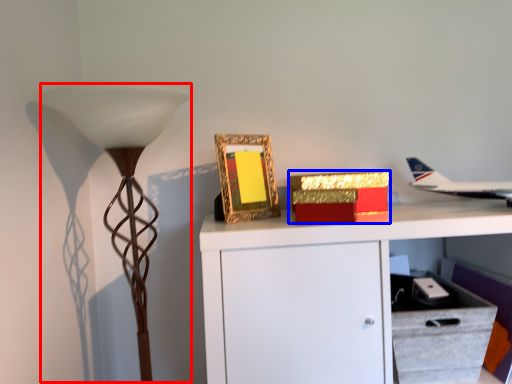
Question: Which point is further to the camera, table lamp (highlighted by a red box) or box (highlighted by a blue box)?

Choices:
 (A) table lamp
 (B) box

Answer: (B)